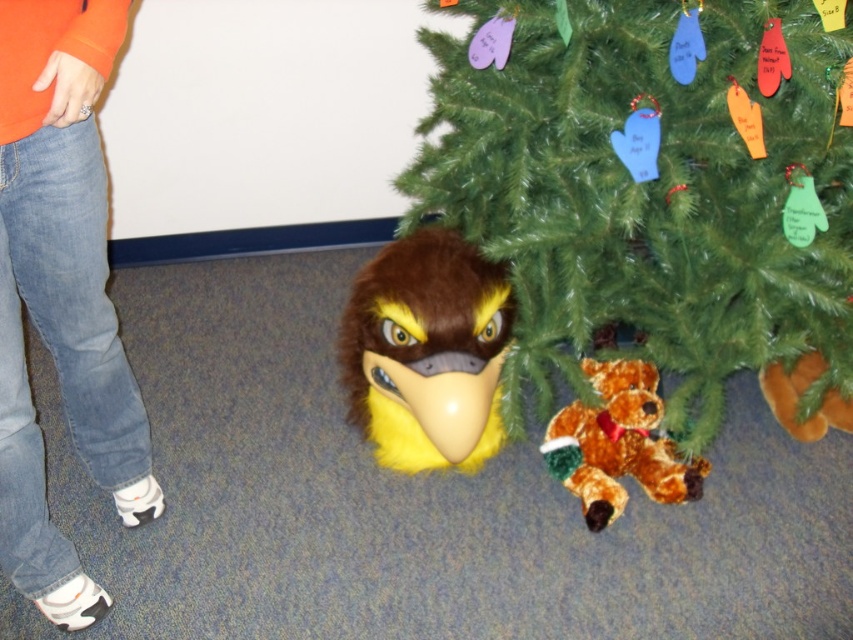
You are standing in the festive indoor setting. The green matte Christmas tree at center is represented by point (x=654, y=188). Where is the point located in relation to the other objects?

The green matte Christmas tree at center is represented by point (x=654, y=188), which is the central location in the scene.

You are a child looking for a toy to play with. You see the fluffy yellow bird at center and the brown plush bear at lower center. Which toy is positioned more to the left side of the scene?

The fluffy yellow bird at center is positioned more to the left side of the scene than the brown plush bear at lower center.

You are standing in front of the Christmas tree and want to place a gift under it. You have two points marked on the floor where you can place the gift. The first point is at coordinates point (x=628, y=321) and the second is at point (x=614, y=369). Which point is closer to you?

Point (x=628, y=321) is further to the camera than point (x=614, y=369), so the second point is closer to you.